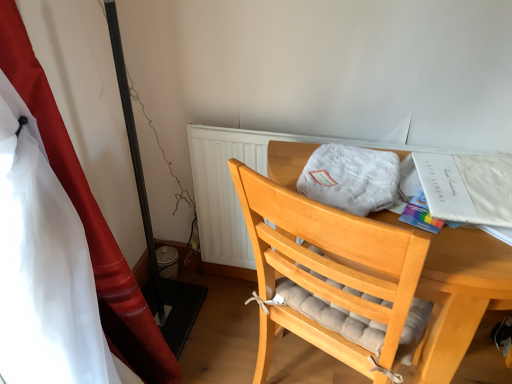
This screenshot has height=384, width=512. In order to click on white fluffy blanket at center in this screenshot , I will do `click(351, 178)`.

The height and width of the screenshot is (384, 512). In order to click on red satin curtain at left in this screenshot , I will do `click(86, 212)`.

The height and width of the screenshot is (384, 512). Identify the location of white fluffy blanket at center. (351, 178).

Is red satin curtain at left positioned far away from white paper at upper right?

That's not correct — red satin curtain at left is a little close to white paper at upper right.

You are a GUI agent. You are given a task and a screenshot of the screen. Output one action in this format:
    pyautogui.click(x=<x>, y=<y>)
    Task: Click on the curtain that is below the white paper at upper right (from the image's perspective)
    
    Given the screenshot: What is the action you would take?
    point(86,212)

Does red satin curtain at left have a greater width compared to white paper at upper right?

Yes.

Is point (108, 230) less distant than point (490, 161)?

No, it is not.

From the image's perspective, which one is positioned lower, white paper at upper right or white fluffy blanket at center?

white paper at upper right.

I want to click on magazine in front of the white fluffy blanket at center, so click(467, 187).

Is white paper at upper right not near white fluffy blanket at center?

white paper at upper right is actually quite close to white fluffy blanket at center.

Between white fluffy blanket at center and white paper at upper right, which one has more height?

Standing taller between the two is white fluffy blanket at center.

Which of these two, white fluffy blanket at center or white paper at upper right, is wider?

white fluffy blanket at center.

Does white fluffy blanket at center touch white paper at upper right?

No, white fluffy blanket at center is not with white paper at upper right.

What's the angular difference between white fluffy blanket at center and white paper at upper right's facing directions?

white fluffy blanket at center and white paper at upper right are facing 13.5 degrees away from each other.

Is light wood desk at center oriented away from white fluffy blanket at center?

No, white fluffy blanket at center is not at the back of light wood desk at center.

This screenshot has width=512, height=384. What are the coordinates of `desk in front of the white fluffy blanket at center` in the screenshot? It's located at point(460,295).

Is light wood desk at center touching white fluffy blanket at center?

No, light wood desk at center is not touching white fluffy blanket at center.

From a real-world perspective, is light wood desk at center positioned above or below white fluffy blanket at center?

light wood desk at center is situated lower than white fluffy blanket at center in the real world.

Is white paper at upper right aimed at red satin curtain at left?

No, white paper at upper right is not aimed at red satin curtain at left.

Is the position of white paper at upper right less distant than that of red satin curtain at left?

No.

At what (x,y) coordinates should I click in order to perform the action: click on magazine above the red satin curtain at left (from a real-world perspective). Please return your answer as a coordinate pair (x, y). Image resolution: width=512 pixels, height=384 pixels. Looking at the image, I should click on (467, 187).

Which of these two, white paper at upper right or red satin curtain at left, is wider?

Wider between the two is red satin curtain at left.

Can you confirm if red satin curtain at left is bigger than light wood desk at center?

No, red satin curtain at left is not bigger than light wood desk at center.

Can you see red satin curtain at left touching light wood desk at center?

No, red satin curtain at left is not next to light wood desk at center.

Is red satin curtain at left looking in the opposite direction of light wood desk at center?

No, light wood desk at center is not at the back of red satin curtain at left.

How different are the orientations of red satin curtain at left and light wood desk at center in degrees?

There is a 91-degree angle between the facing directions of red satin curtain at left and light wood desk at center.

Is light wood desk at center shorter than red satin curtain at left?

Correct, light wood desk at center is not as tall as red satin curtain at left.

Consider the image. Who is smaller, light wood desk at center or red satin curtain at left?

With smaller size is red satin curtain at left.

From the picture: Are light wood desk at center and red satin curtain at left beside each other?

light wood desk at center and red satin curtain at left are not in contact.

Is red satin curtain at left at the back of light wood desk at center?

light wood desk at center does not have its back to red satin curtain at left.

Identify the location of magazine located above the red satin curtain at left (from a real-world perspective). The height and width of the screenshot is (384, 512). (467, 187).

The height and width of the screenshot is (384, 512). Find the location of `magazine that appears below the white fluffy blanket at center (from the image's perspective)`. magazine that appears below the white fluffy blanket at center (from the image's perspective) is located at coordinates (467, 187).

Looking at the image, which one is located further to white paper at upper right, light wood desk at center or white fluffy blanket at center?

light wood desk at center is further to white paper at upper right.

Based on their spatial positions, is white fluffy blanket at center or red satin curtain at left further from white paper at upper right?

red satin curtain at left.

Considering their positions, is red satin curtain at left positioned further to white fluffy blanket at center than white paper at upper right?

red satin curtain at left.

Considering their positions, is white fluffy blanket at center positioned further to light wood desk at center than white paper at upper right?

white paper at upper right is further to light wood desk at center.

From the image, which object appears to be nearer to red satin curtain at left, white paper at upper right or white fluffy blanket at center?

white fluffy blanket at center.

From the image, which object appears to be nearer to light wood desk at center, red satin curtain at left or white fluffy blanket at center?

white fluffy blanket at center is closer to light wood desk at center.

Estimate the real-world distances between objects in this image. Which object is closer to red satin curtain at left, light wood desk at center or white paper at upper right?

light wood desk at center lies closer to red satin curtain at left than the other object.

From the image, which object appears to be farther from white fluffy blanket at center, red satin curtain at left or light wood desk at center?

Among the two, red satin curtain at left is located further to white fluffy blanket at center.

Identify the location of cloth between red satin curtain at left and white paper at upper right in the horizontal direction. This screenshot has width=512, height=384. (351, 178).

Where is `magazine between white fluffy blanket at center and light wood desk at center vertically`? magazine between white fluffy blanket at center and light wood desk at center vertically is located at coordinates (467, 187).

At what (x,y) coordinates should I click in order to perform the action: click on desk located between red satin curtain at left and white paper at upper right in the left-right direction. Please return your answer as a coordinate pair (x, y). This screenshot has height=384, width=512. Looking at the image, I should click on (460, 295).

The height and width of the screenshot is (384, 512). I want to click on cloth located between red satin curtain at left and light wood desk at center in the left-right direction, so click(351, 178).